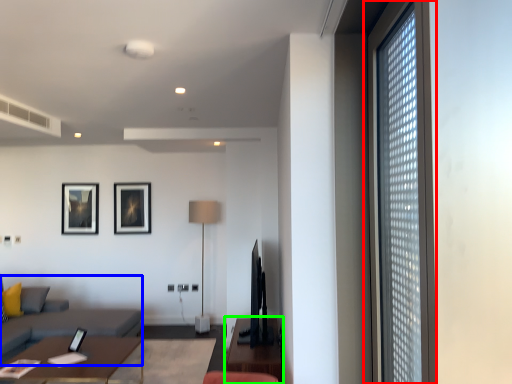
Question: Based on their relative distances, which object is nearer to window (highlighted by a red box)? Choose from couch (highlighted by a blue box) and table (highlighted by a green box).

Choices:
 (A) couch
 (B) table

Answer: (B)